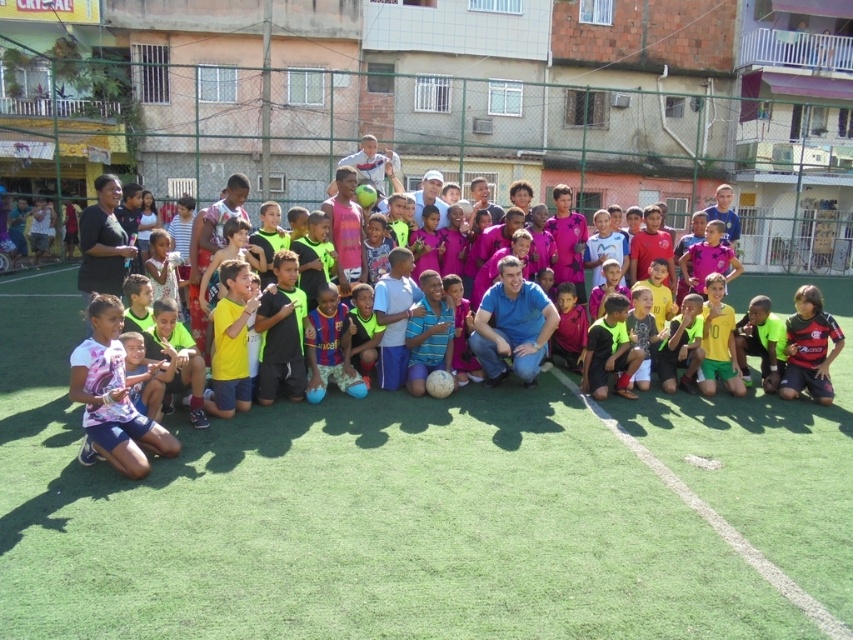
You are a photographer trying to capture a wide shot of the soccer event. You notice the green artificial turf at center and the black jersey at center in your frame. Which object should you focus on to ensure the larger one is properly in focus?

The green artificial turf at center is larger in size than the black jersey at center, so you should focus on the green artificial turf at center to ensure the larger object is properly in focus.

You are a photographer standing at the edge of the field. You want to capture a photo that includes both the pink jersey at lower left and the striped cotton shirt at center. What is the minimum distance you need to move backward to ensure both subjects are in frame?

The pink jersey at lower left is 10.06 feet from the striped cotton shirt at center. To include both in the frame, you need to move backward until the distance between them fits within your camera lens field of view. However, without knowing the camera sensor size or focal length, an exact distance cannot be calculated. A general rule is to position yourself at least 15 feet away to ensure both are visible.